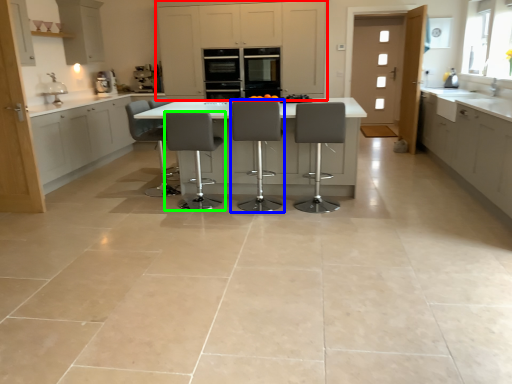
Question: Which object is the farthest from cabinetry (highlighted by a red box)? Choose among these: chair (highlighted by a blue box) or chair (highlighted by a green box).

Choices:
 (A) chair
 (B) chair

Answer: (A)